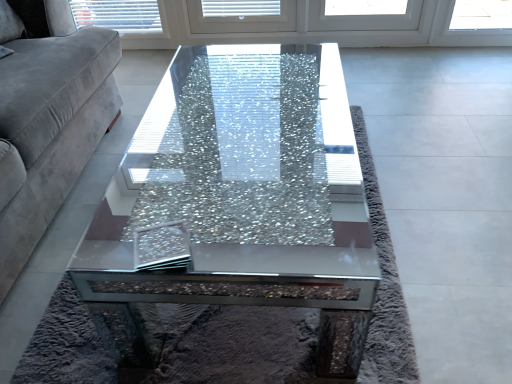
This screenshot has width=512, height=384. Identify the location of velvet gray couch at left. (47, 126).

Describe the element at coordinates (47, 126) in the screenshot. The image size is (512, 384). I see `velvet gray couch at left` at that location.

What do you see at coordinates (245, 185) in the screenshot?
I see `cracked glass coffee table at center` at bounding box center [245, 185].

The width and height of the screenshot is (512, 384). I want to click on cracked glass coffee table at center, so click(245, 185).

Image resolution: width=512 pixels, height=384 pixels. In order to click on velvet gray couch at left in this screenshot , I will do `click(47, 126)`.

Which is more to the left, cracked glass coffee table at center or velvet gray couch at left?

Positioned to the left is velvet gray couch at left.

Is the depth of cracked glass coffee table at center greater than that of velvet gray couch at left?

Yes, cracked glass coffee table at center is further from the viewer.

Which is further, (356, 337) or (84, 40)?

The point (84, 40) is behind.

From the image's perspective, is cracked glass coffee table at center above velvet gray couch at left?

No, from the image's perspective, cracked glass coffee table at center is not on top of velvet gray couch at left.

From a real-world perspective, is cracked glass coffee table at center on velvet gray couch at left?

Incorrect, from a real-world perspective, cracked glass coffee table at center is lower than velvet gray couch at left.

Considering the sizes of cracked glass coffee table at center and velvet gray couch at left in the image, is cracked glass coffee table at center wider or thinner than velvet gray couch at left?

Considering their sizes, cracked glass coffee table at center looks slimmer than velvet gray couch at left.

Is cracked glass coffee table at center taller or shorter than velvet gray couch at left?

cracked glass coffee table at center is shorter than velvet gray couch at left.

Based on their sizes in the image, would you say cracked glass coffee table at center is bigger or smaller than velvet gray couch at left?

Considering their sizes, cracked glass coffee table at center takes up less space than velvet gray couch at left.

Which is correct: cracked glass coffee table at center is inside velvet gray couch at left, or outside of it?

cracked glass coffee table at center is not inside velvet gray couch at left, it's outside.

Are cracked glass coffee table at center and velvet gray couch at left located far from each other?

No.

Is cracked glass coffee table at center oriented away from velvet gray couch at left?

Yes, velvet gray couch at left is at the back of cracked glass coffee table at center.

Can you tell me how much cracked glass coffee table at center and velvet gray couch at left differ in facing direction?

The angle between the facing direction of cracked glass coffee table at center and the facing direction of velvet gray couch at left is 0.971 degrees.

Find the location of a particular element. coffee table below the velvet gray couch at left (from a real-world perspective) is located at coordinates (245, 185).

Which is more to the left, velvet gray couch at left or cracked glass coffee table at center?

velvet gray couch at left is more to the left.

In the image, is velvet gray couch at left positioned in front of or behind cracked glass coffee table at center?

Clearly, velvet gray couch at left is in front of cracked glass coffee table at center.

Between point (3, 160) and point (218, 252), which one is positioned in front?

The point (3, 160) is closer.

From the image's perspective, who appears lower, velvet gray couch at left or cracked glass coffee table at center?

From the image's view, cracked glass coffee table at center is below.

From a real-world perspective, is velvet gray couch at left on top of cracked glass coffee table at center?

Yes, from a real-world perspective, velvet gray couch at left is on top of cracked glass coffee table at center.

Can you confirm if velvet gray couch at left is thinner than cracked glass coffee table at center?

No.

Between velvet gray couch at left and cracked glass coffee table at center, which one has more height?

With more height is velvet gray couch at left.

Based on the photo, who is smaller, velvet gray couch at left or cracked glass coffee table at center?

cracked glass coffee table at center.

Is cracked glass coffee table at center inside velvet gray couch at left?

No, cracked glass coffee table at center is not surrounded by velvet gray couch at left.

Is velvet gray couch at left positioned far away from cracked glass coffee table at center?

No, there isn't a large distance between velvet gray couch at left and cracked glass coffee table at center.

Is velvet gray couch at left looking in the opposite direction of cracked glass coffee table at center?

velvet gray couch at left is not turned away from cracked glass coffee table at center.

Can you tell me how much velvet gray couch at left and cracked glass coffee table at center differ in facing direction?

They differ by 0.971 degrees in their facing directions.

This screenshot has height=384, width=512. Identify the location of coffee table on the right of velvet gray couch at left. (245, 185).

The width and height of the screenshot is (512, 384). Find the location of `coffee table on the right side of velvet gray couch at left`. coffee table on the right side of velvet gray couch at left is located at coordinates (245, 185).

You are a GUI agent. You are given a task and a screenshot of the screen. Output one action in this format:
    pyautogui.click(x=<x>, y=<y>)
    Task: Click on the coffee table behind the velvet gray couch at left
    The width and height of the screenshot is (512, 384).
    Given the screenshot: What is the action you would take?
    (245, 185)